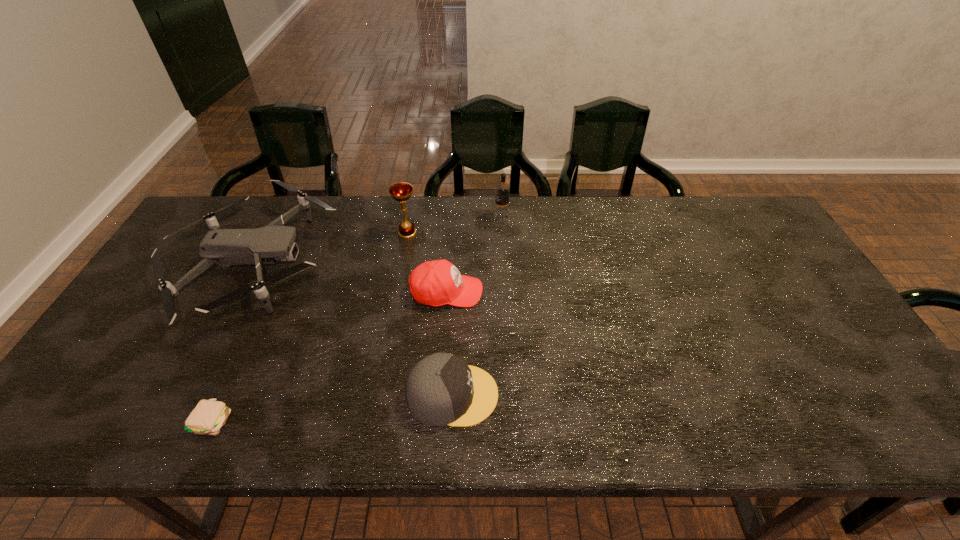
You are a GUI agent. You are given a task and a screenshot of the screen. Output one action in this format:
    pyautogui.click(x=<x>, y=<y>)
    Task: Click on the rightmost object
    The width and height of the screenshot is (960, 540).
    Given the screenshot: What is the action you would take?
    pyautogui.click(x=501, y=213)

I want to click on chalice, so click(x=402, y=191).

Identify the location of drone. The width and height of the screenshot is (960, 540). (224, 247).

Locate an element on the screen. baseball cap is located at coordinates (435, 283).

Where is `cap`? The height and width of the screenshot is (540, 960). cap is located at coordinates (442, 389).

Where is `the shortest object`? The height and width of the screenshot is (540, 960). the shortest object is located at coordinates (208, 417).

I want to click on vacant space located 0.300m on the label of the rightmost object, so click(x=404, y=217).

The image size is (960, 540). Identify the location of vacant space located on the label of the rightmost object. (443, 217).

This screenshot has height=540, width=960. I want to click on vacant space located 0.390m on the label of the rightmost object, so click(x=377, y=217).

I want to click on vacant space situated on the left of the chalice, so click(x=377, y=233).